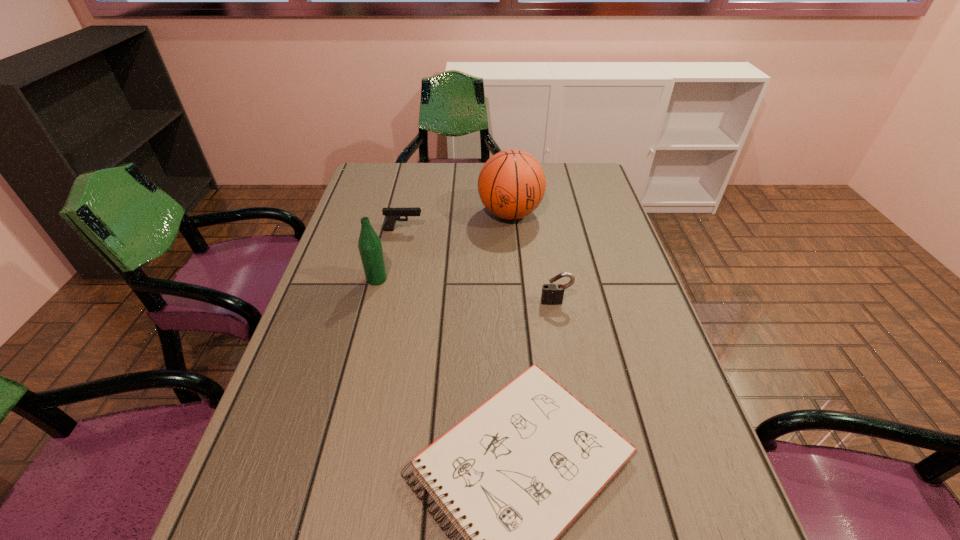
Find the location of `vacant area between the second nearest object and the basketball`. vacant area between the second nearest object and the basketball is located at coordinates (533, 258).

In order to click on blank region between the basketball and the third tallest object in this screenshot , I will do `click(533, 258)`.

Identify the location of free area in between the pistol and the fourth farthest object. The width and height of the screenshot is (960, 540). (480, 266).

Locate an element on the screen. This screenshot has height=540, width=960. vacant region between the second shortest object and the basketball is located at coordinates (457, 222).

Locate which object is the closest to the padlock. Please provide its 2D coordinates. Your answer should be formatted as a tuple, i.e. [(x, y)], where the tuple contains the x and y coordinates of a point satisfying the conditions above.

[(512, 476)]

Identify the location of object that ranks as the second closest to the notepad. The height and width of the screenshot is (540, 960). (370, 247).